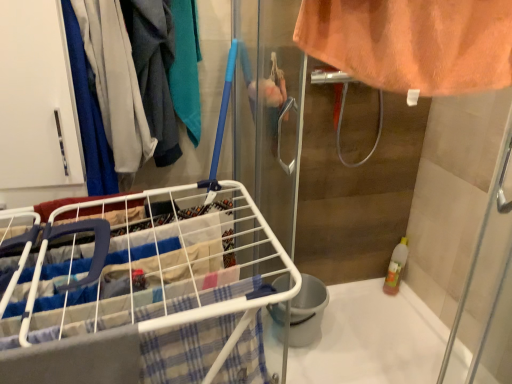
Question: Can you confirm if matte blue fabric at left is smaller than white wire laundry cart at lower left?

Choices:
 (A) no
 (B) yes

Answer: (B)

Question: From the image's perspective, is matte blue fabric at left located beneath white wire laundry cart at lower left?

Choices:
 (A) yes
 (B) no

Answer: (B)

Question: Considering the relative sizes of matte blue fabric at left and white wire laundry cart at lower left in the image provided, is matte blue fabric at left bigger than white wire laundry cart at lower left?

Choices:
 (A) no
 (B) yes

Answer: (A)

Question: From a real-world perspective, is matte blue fabric at left physically above white wire laundry cart at lower left?

Choices:
 (A) yes
 (B) no

Answer: (A)

Question: Considering the relative sizes of matte blue fabric at left and white wire laundry cart at lower left in the image provided, is matte blue fabric at left thinner than white wire laundry cart at lower left?

Choices:
 (A) no
 (B) yes

Answer: (B)

Question: Does matte blue fabric at left have a greater height compared to white wire laundry cart at lower left?

Choices:
 (A) no
 (B) yes

Answer: (A)

Question: Is matte blue fabric at left inside white glossy bath at lower right?

Choices:
 (A) yes
 (B) no

Answer: (B)

Question: Can you confirm if white glossy bath at lower right is shorter than matte blue fabric at left?

Choices:
 (A) no
 (B) yes

Answer: (B)

Question: Is white glossy bath at lower right to the right of matte blue fabric at left from the viewer's perspective?

Choices:
 (A) yes
 (B) no

Answer: (A)

Question: From a real-world perspective, is white glossy bath at lower right physically below matte blue fabric at left?

Choices:
 (A) no
 (B) yes

Answer: (B)

Question: Can we say white glossy bath at lower right lies outside matte blue fabric at left?

Choices:
 (A) no
 (B) yes

Answer: (B)

Question: From the image's perspective, would you say white glossy bath at lower right is shown under matte blue fabric at left?

Choices:
 (A) no
 (B) yes

Answer: (B)

Question: Does matte blue fabric at left have a smaller size compared to white glossy bath at lower right?

Choices:
 (A) yes
 (B) no

Answer: (A)